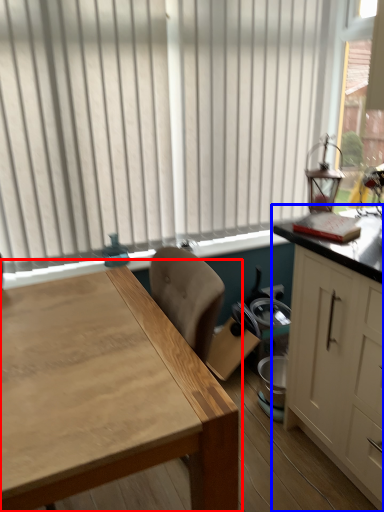
Question: Which of the following is the farthest to the observer, table (highlighted by a red box) or cabinetry (highlighted by a blue box)?

Choices:
 (A) table
 (B) cabinetry

Answer: (B)